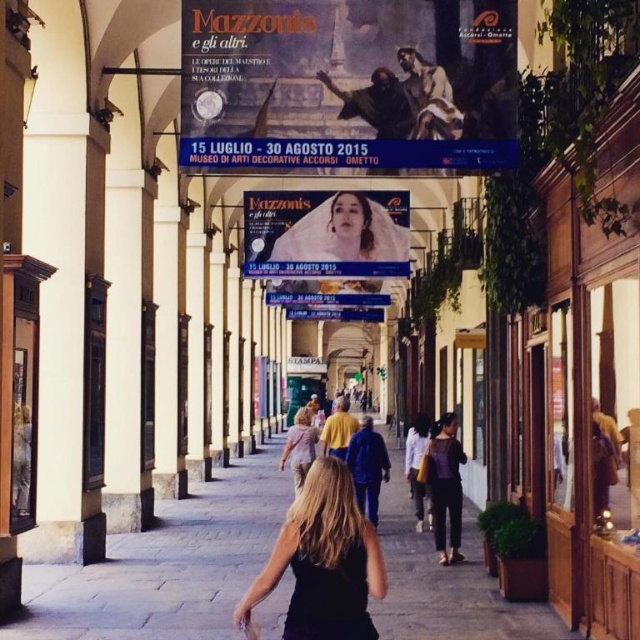
Can you confirm if matte white fabric at upper center is positioned to the right of black satin dress at center?

No, matte white fabric at upper center is not to the right of black satin dress at center.

Based on the photo, between matte white fabric at upper center and black satin dress at center, which one is positioned lower?

black satin dress at center is lower down.

Locate an element on the screen. The width and height of the screenshot is (640, 640). matte white fabric at upper center is located at coordinates (324, 234).

This screenshot has width=640, height=640. Identify the location of matte white fabric at upper center. coord(324,234).

Between black satin dress at center and dark brown leather jacket at center, which one appears on the right side from the viewer's perspective?

From the viewer's perspective, dark brown leather jacket at center appears more on the right side.

Is point (364, 570) positioned after point (435, 538)?

No.

Where is `black satin dress at center`? black satin dress at center is located at coordinates (333, 595).

Is matte oil painting at upper center wider than black matte dress at center?

Indeed, matte oil painting at upper center has a greater width compared to black matte dress at center.

Describe the element at coordinates (348, 83) in the screenshot. I see `matte oil painting at upper center` at that location.

Measure the distance between matte oil painting at upper center and camera.

matte oil painting at upper center and camera are 15.24 meters apart.

At what (x,y) coordinates should I click in order to perform the action: click on matte oil painting at upper center. Please return your answer as a coordinate pair (x, y). This screenshot has height=640, width=640. Looking at the image, I should click on (348, 83).